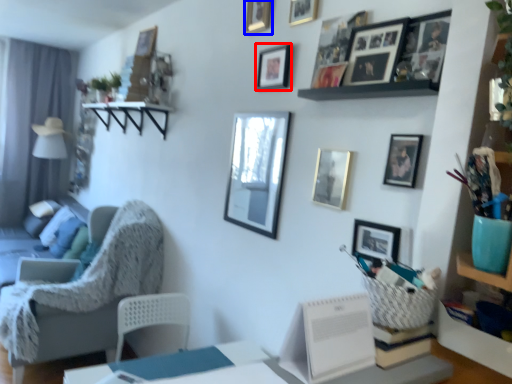
Question: Which of the following is the farthest to the observer, picture frame (highlighted by a red box) or picture frame (highlighted by a blue box)?

Choices:
 (A) picture frame
 (B) picture frame

Answer: (B)